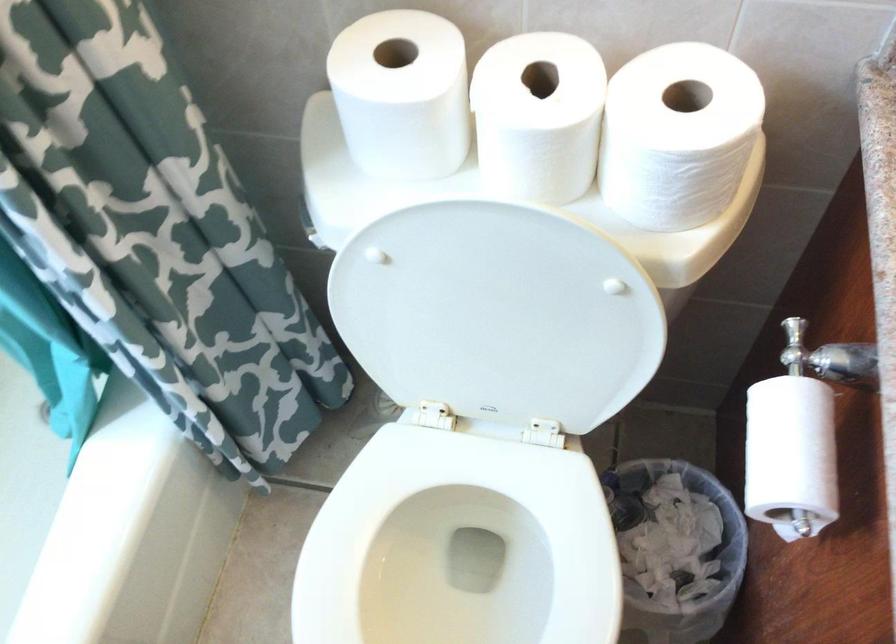
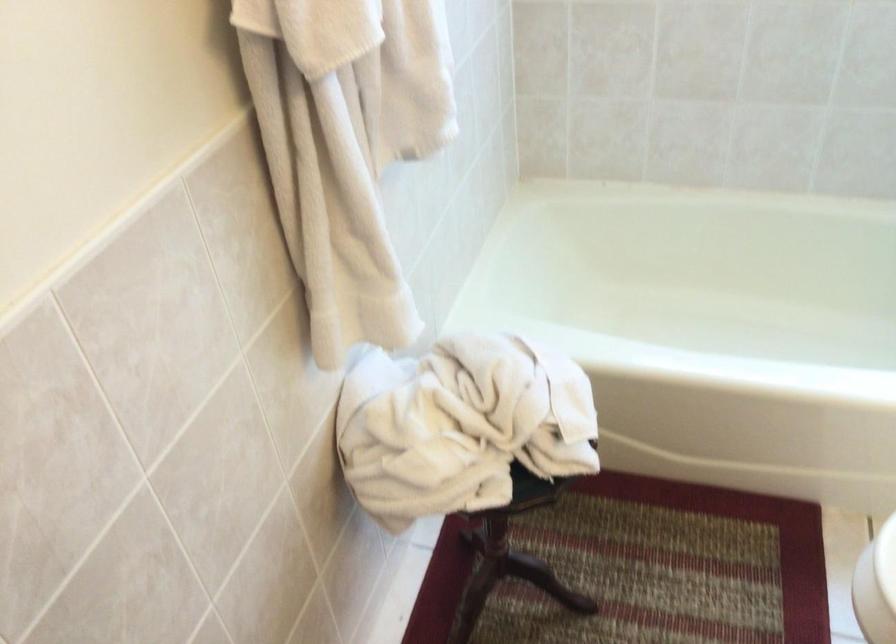
The images are taken continuously from a first-person perspective. In which direction is your viewpoint rotating?

The camera rotated toward left-down.